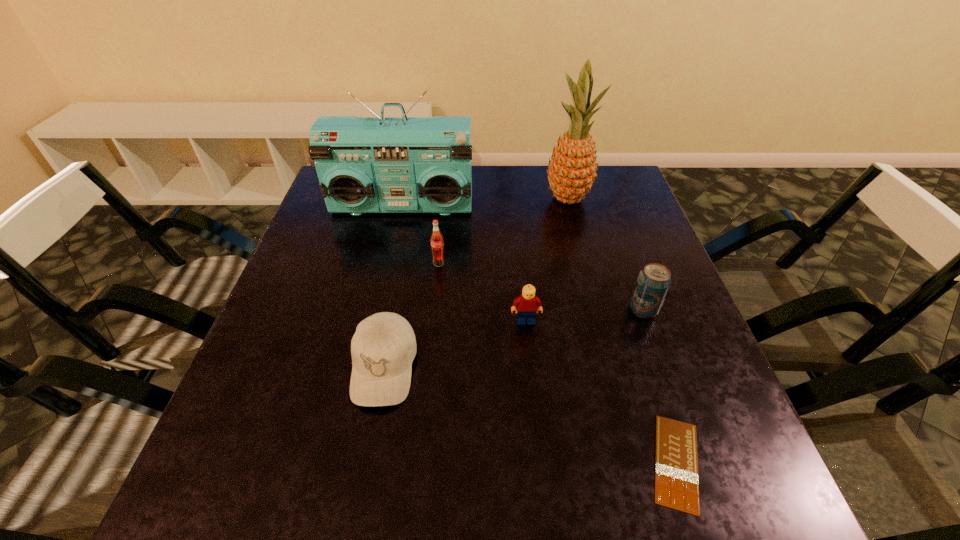
Where is `pineapple that is at the right edge`? pineapple that is at the right edge is located at coordinates (572, 169).

The height and width of the screenshot is (540, 960). In order to click on pop soda present at the right edge in this screenshot , I will do `click(654, 280)`.

Where is `chocolate bar that is at the right edge`? chocolate bar that is at the right edge is located at coordinates (676, 460).

This screenshot has height=540, width=960. What are the coordinates of `object that is at the far left corner` in the screenshot? It's located at (404, 164).

Locate an element on the screen. Image resolution: width=960 pixels, height=540 pixels. object that is at the far right corner is located at coordinates (572, 169).

The height and width of the screenshot is (540, 960). What are the coordinates of `object present at the near right corner` in the screenshot? It's located at (676, 460).

Find the location of a particular element. The width and height of the screenshot is (960, 540). vacant area at the far edge is located at coordinates (538, 211).

This screenshot has width=960, height=540. In the image, there is a desktop. Identify the location of vacant space at the near edge. (616, 471).

You are a GUI agent. You are given a task and a screenshot of the screen. Output one action in this format:
    pyautogui.click(x=<x>, y=<y>)
    Task: Click on the free space at the left edge
    The width and height of the screenshot is (960, 540).
    Given the screenshot: What is the action you would take?
    pyautogui.click(x=292, y=417)

Find the location of `vacant space at the far right corner of the desktop`. vacant space at the far right corner of the desktop is located at coordinates (628, 194).